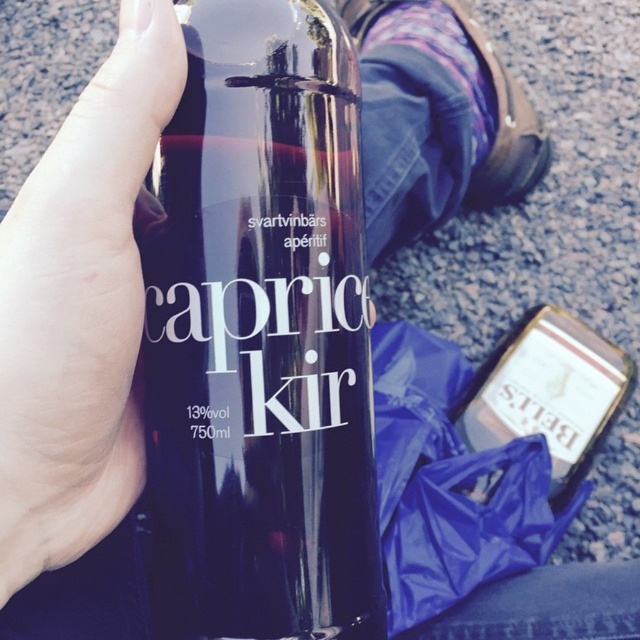
You are a bartender who needs to pour the contents of the glossy glass bottle at upper center into a glass. Considering the size of the smooth skin hand at upper left holding it, will the bottle fit comfortably in the hand for pouring?

The glossy glass bottle at upper center is bigger than the smooth skin hand at upper left, so it may be difficult to hold and pour comfortably due to its larger size compared to the hand.

What are the coordinates of the glossy glass bottle at upper center?

The glossy glass bottle at upper center is located at coordinates point (259, 336).